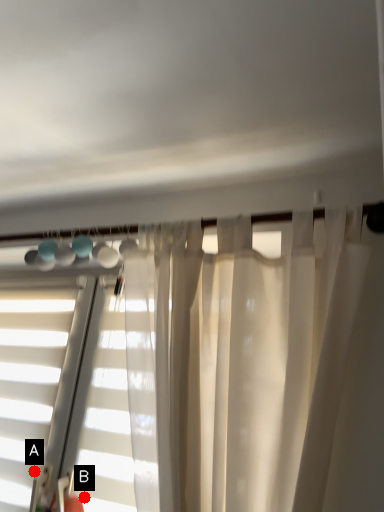
Question: Two points are circled on the image, labeled by A and B beside each circle. Which point is closer to the camera taking this photo?

Choices:
 (A) A is closer
 (B) B is closer

Answer: (B)